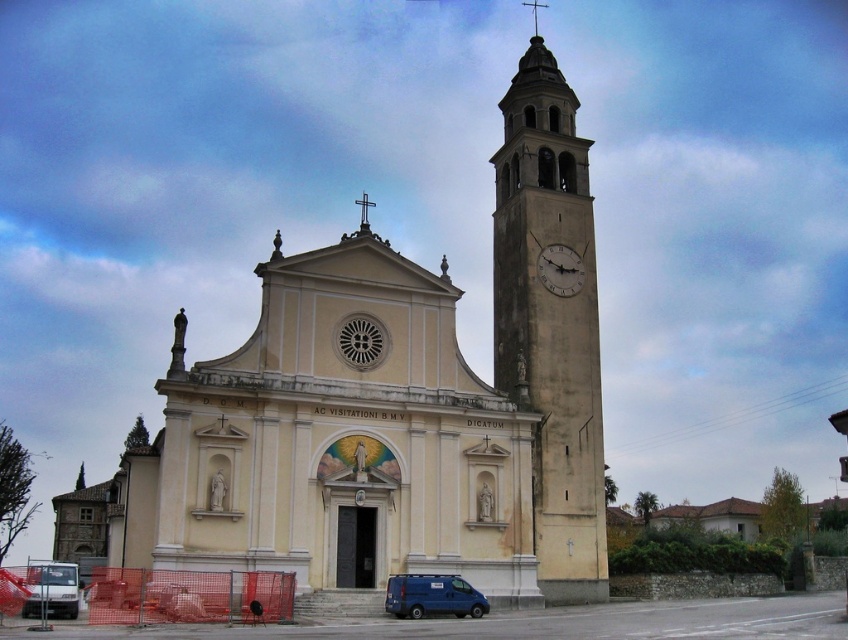
Which is below, light beige stone clock tower at right or matte gray clock at upper right?

Positioned lower is matte gray clock at upper right.

Can you confirm if light beige stone clock tower at right is shorter than matte gray clock at upper right?

No.

Is point (511, 112) in front of point (553, 289)?

No, (511, 112) is further to viewer.

Find the location of a particular element. light beige stone clock tower at right is located at coordinates (550, 323).

Between beige stone church at center and white matte van at lower left, which one appears on the left side from the viewer's perspective?

white matte van at lower left

Is beige stone church at center positioned at the back of white matte van at lower left?

Yes, beige stone church at center is behind white matte van at lower left.

The width and height of the screenshot is (848, 640). Describe the element at coordinates (399, 404) in the screenshot. I see `beige stone church at center` at that location.

The height and width of the screenshot is (640, 848). I want to click on beige stone church at center, so click(399, 404).

Can you confirm if light beige stone clock tower at right is positioned below blue matte van at lower center?

No, light beige stone clock tower at right is not below blue matte van at lower center.

Does light beige stone clock tower at right appear on the right side of blue matte van at lower center?

Correct, you'll find light beige stone clock tower at right to the right of blue matte van at lower center.

Does point (589, 237) lie behind point (414, 589)?

Yes, it is behind point (414, 589).

Find the location of `light beige stone clock tower at right`. light beige stone clock tower at right is located at coordinates (550, 323).